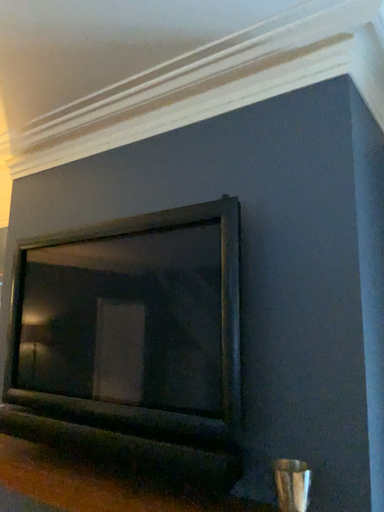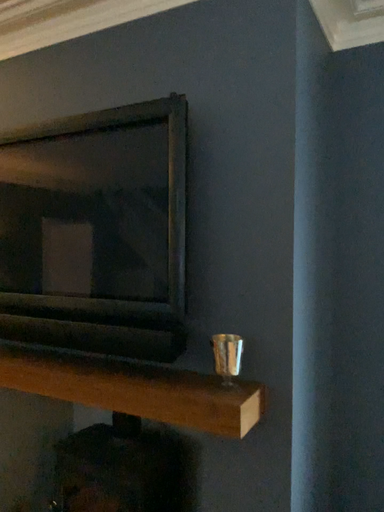
Question: How did the camera likely rotate when shooting the video?

Choices:
 (A) rotated upward
 (B) rotated downward

Answer: (B)